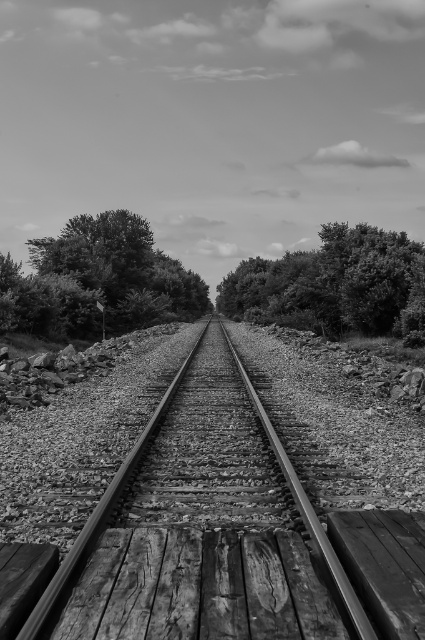
Is point (229, 410) in front of point (299, 317)?

That is True.

Who is taller, metal/rough train track at center or thick green foliage at center?

thick green foliage at center

At what (x,y) coordinates should I click in order to perform the action: click on metal/rough train track at center. Please return your answer as a coordinate pair (x, y). The image size is (425, 640). Looking at the image, I should click on (203, 529).

Is green leafy tree at center taller than thick green foliage at center?

Yes.

Does point (99, 326) lie behind point (268, 268)?

That is False.

The image size is (425, 640). Identify the location of green leafy tree at center. pos(98,280).

In the scene shown: Between metal/rough train track at center and green leafy tree at center, which one has less height?

With less height is metal/rough train track at center.

Which is more to the left, metal/rough train track at center or green leafy tree at center?

Positioned to the left is green leafy tree at center.

I want to click on metal/rough train track at center, so click(x=203, y=529).